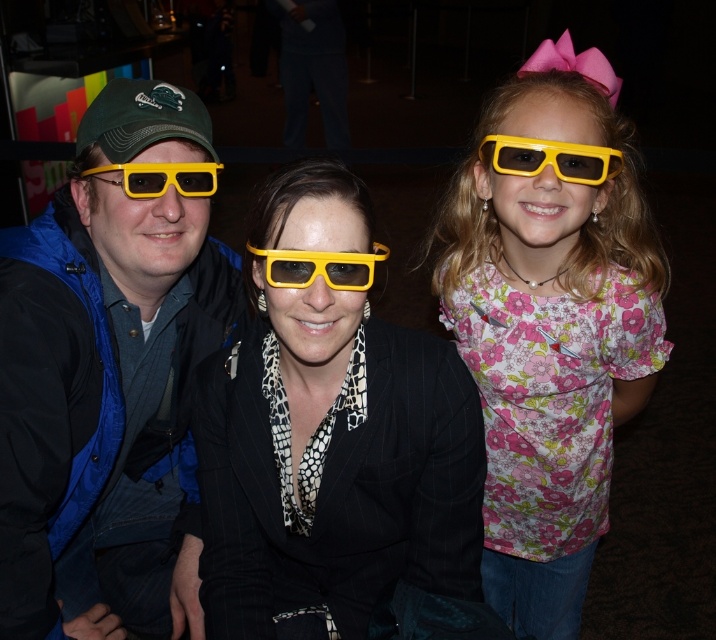
You are a photographer trying to adjust the lighting for the group photo. The floral fabric shirt at center and the yellow matte 3d glasses at left are casting shadows on the background. Which object is closer to the light source to cause a longer shadow?

The yellow matte 3d glasses at left is closer to the light source because it is farther from the floral fabric shirt at center, which would result in a longer shadow.

You are a photographer trying to adjust the lighting for the three individuals in the scene. You need to ensure that both the matte yellow plastic glasses at left and the yellow matte 3d glasses at left are well lit. Given the distance between them, can you estimate whether you can illuminate both effectively with a single light source placed centrally between them?

The distance between the matte yellow plastic glasses at left and the yellow matte 3d glasses at left is 36.54 centimeters. Placing a light source centrally between them would mean each is approximately 18.27 centimeters away from the light, allowing both to be illuminated effectively.